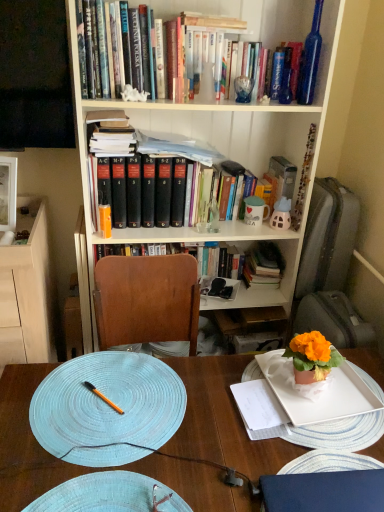
Question: From a real-world perspective, is black glossy television at upper left above or below white matte bookcase at upper center?

Choices:
 (A) below
 (B) above

Answer: (B)

Question: Based on their positions, is black glossy television at upper left located to the left or right of white matte bookcase at upper center?

Choices:
 (A) right
 (B) left

Answer: (B)

Question: Considering the real-world distances, which object is closest to the white ceramic mug at upper center?

Choices:
 (A) blue woven placemat at center, arranged as the 1th plate when viewed from the left
 (B) black glossy television at upper left
 (C) light wood cabinet at left
 (D) white paper notebook at center
 (E) white matte plate at lower right, acting as the 1th plate starting from the right

Answer: (E)

Question: Considering the real-world distances, which object is closest to the white paper notebook at center?

Choices:
 (A) white matte bookcase at upper center
 (B) black glossy television at upper left
 (C) white matte plate at lower right, acting as the 1th plate starting from the right
 (D) orange glossy pen at center
 (E) blue woven placemat at center

Answer: (C)